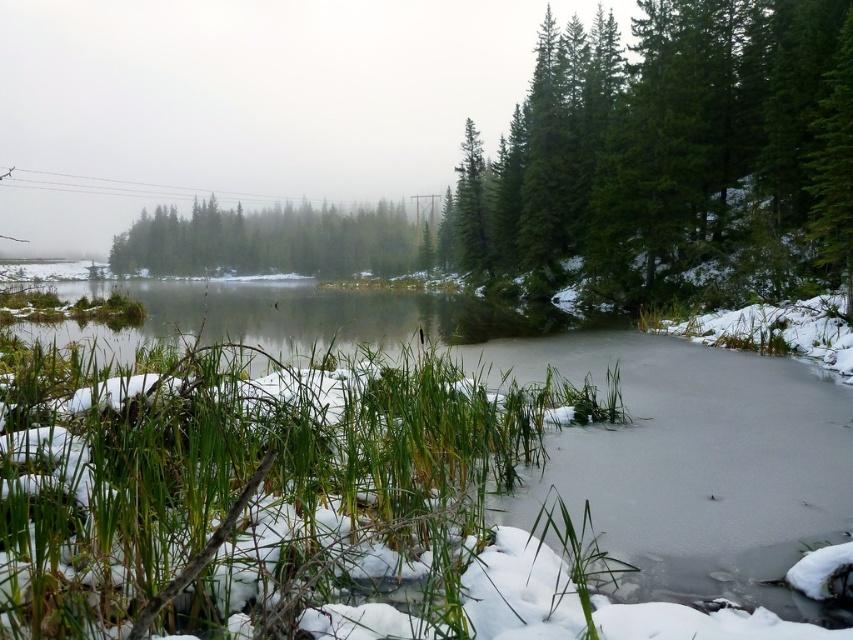
Is green matte tree at upper right below green matte trees at center?

Yes.

How much distance is there between green matte tree at upper right and green matte trees at center?

The distance of green matte tree at upper right from green matte trees at center is 42.57 meters.

Does point (637, 289) come in front of point (213, 228)?

That is True.

This screenshot has height=640, width=853. Find the location of `green matte tree at upper right`. green matte tree at upper right is located at coordinates (672, 156).